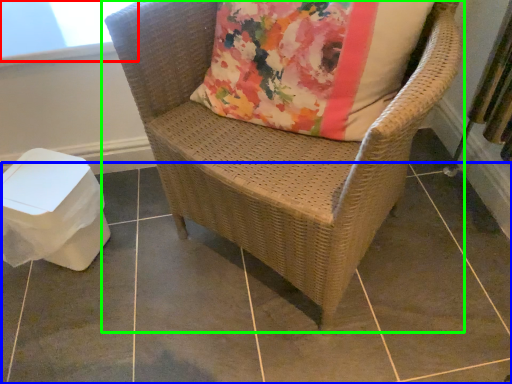
Question: Which object is the farthest from window screen (highlighted by a red box)? Choose among these: tile (highlighted by a blue box) or chair (highlighted by a green box).

Choices:
 (A) tile
 (B) chair

Answer: (A)